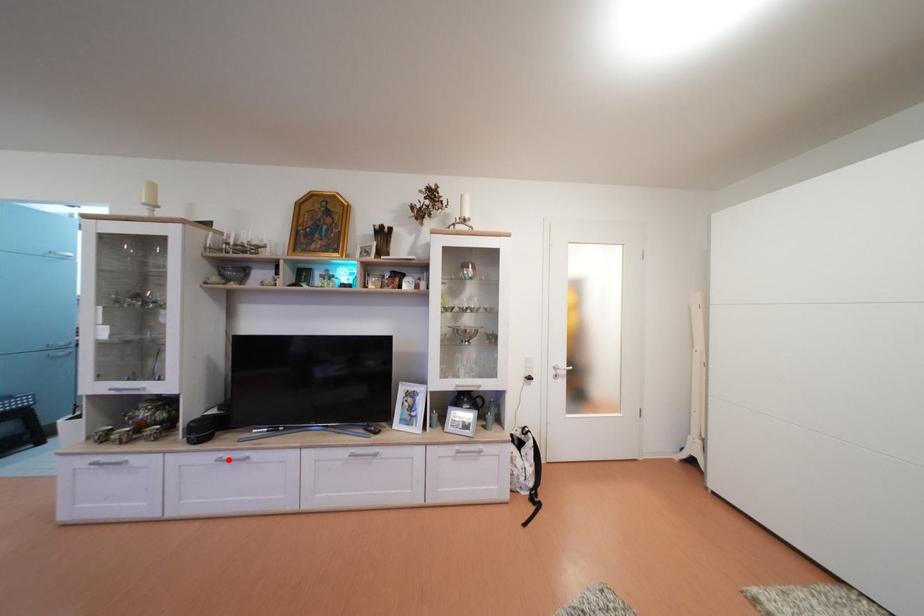
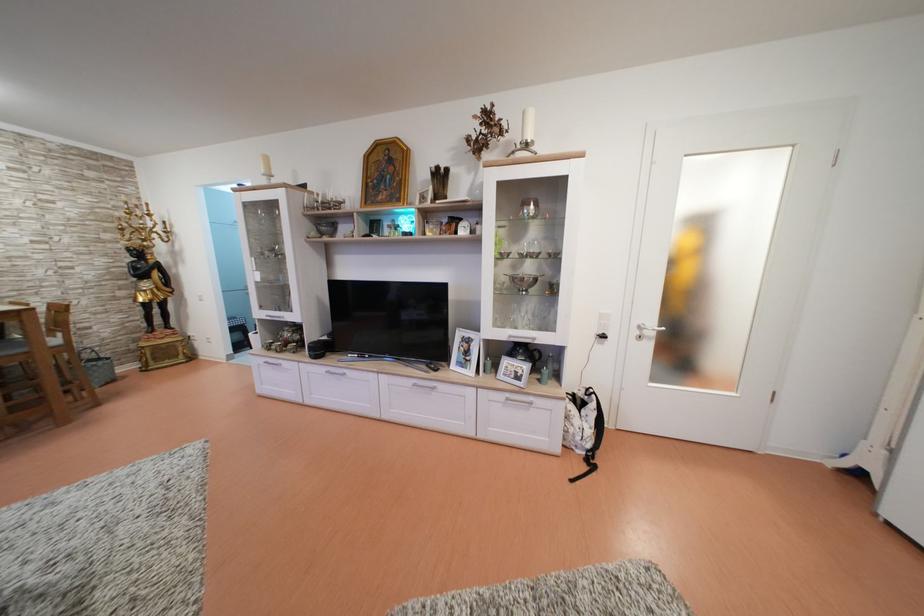
The point at the highlighted location is marked in the first image. Where is the corresponding point in the second image?

(335, 374)